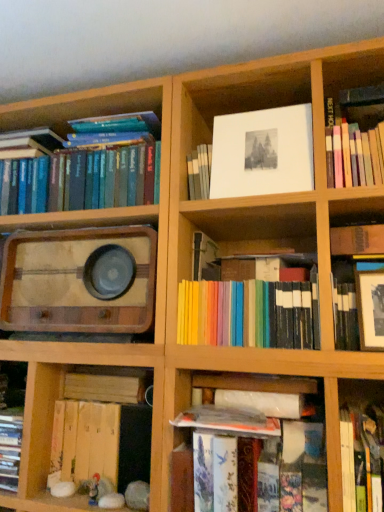
Question: From a real-world perspective, is white paper at upper center positioned above or below hardcover books at lower center?

Choices:
 (A) below
 (B) above

Answer: (B)

Question: From the image's perspective, is white paper at upper center positioned above or below hardcover books at lower center?

Choices:
 (A) above
 (B) below

Answer: (A)

Question: Which is farther from the wooden vintage radio at left?

Choices:
 (A) white paper at upper center
 (B) wooden book at lower left, placed as the third book when sorted from left to right
 (C) pastel rainbow books at center, positioned as the 4th book in right-to-left order
 (D) hardcover book at upper right, marked as the seventh book in a left-to-right arrangement
 (E) hardcover book at lower right, positioned as the third book in right-to-left order

Answer: (E)

Question: Estimate the real-world distances between objects in this image. Which object is closer to the hardcover books at left, placed as the 1th book when sorted from left to right?

Choices:
 (A) pastel rainbow books at center, arranged as the 4th book when viewed from the left
 (B) wooden book at lower left, placed as the third book when sorted from left to right
 (C) hardcover books at lower center
 (D) hardcover book at upper right, marked as the seventh book in a left-to-right arrangement
 (E) hardcover book at lower right, positioned as the third book in right-to-left order

Answer: (A)